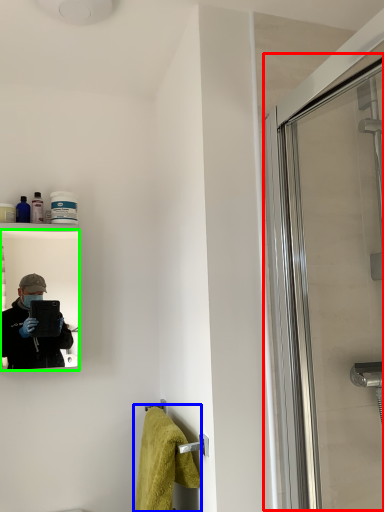
Question: Based on their relative distances, which object is farther from screen door (highlighted by a red box)? Choose from bath towel (highlighted by a blue box) and mirror (highlighted by a green box).

Choices:
 (A) bath towel
 (B) mirror

Answer: (B)